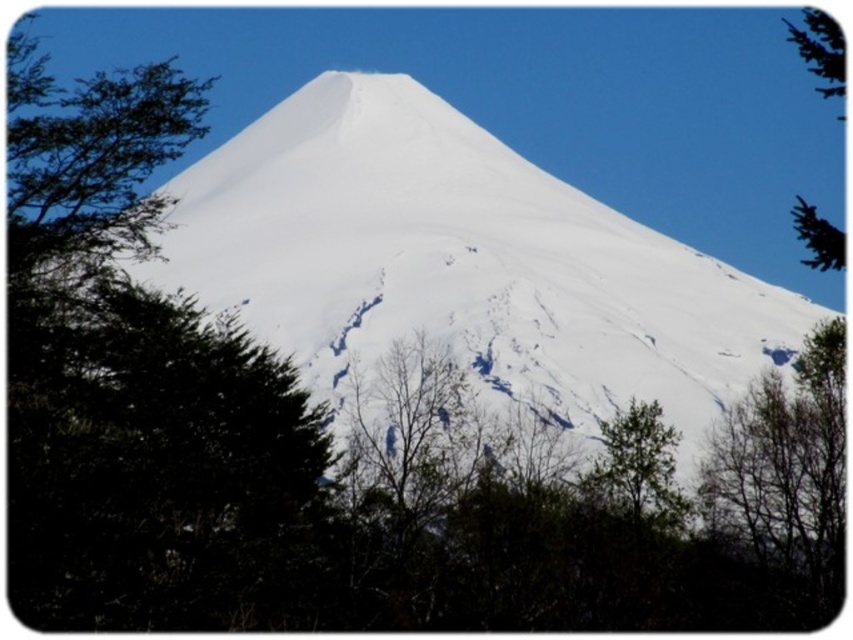
Who is lower down, white snow-covered mountain at center or green leafy tree at lower right?

Positioned lower is green leafy tree at lower right.

Does white snow-covered mountain at center have a larger size compared to green leafy tree at lower right?

Yes, white snow-covered mountain at center is bigger than green leafy tree at lower right.

Who is more forward, (651, 248) or (672, 529)?

Point (672, 529) is in front.

Where is `white snow-covered mountain at center`? white snow-covered mountain at center is located at coordinates (457, 262).

Is green leafy tree at lower right to the right of green leafy tree at upper right from the viewer's perspective?

No, green leafy tree at lower right is not to the right of green leafy tree at upper right.

Which is more to the left, green leafy tree at lower right or green leafy tree at upper right?

Positioned to the left is green leafy tree at lower right.

The height and width of the screenshot is (640, 853). I want to click on green leafy tree at lower right, so click(x=637, y=468).

I want to click on green leafy tree at lower right, so click(637, 468).

Who is more forward, [676,428] or [820,236]?

Point [820,236] is in front.

In order to click on white snow-covered mountain at center in this screenshot , I will do `click(457, 262)`.